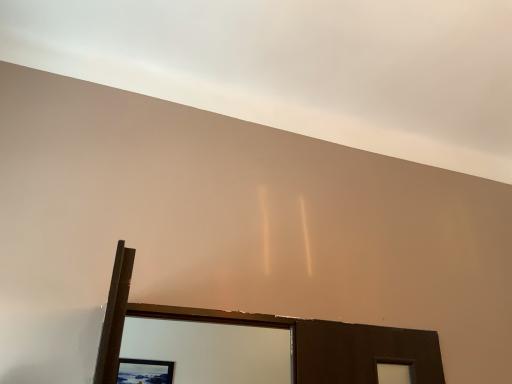
Question: From the image's perspective, is white matte ceiling at upper center located above or below wooden picture frame at lower center?

Choices:
 (A) above
 (B) below

Answer: (A)

Question: Is white matte ceiling at upper center inside or outside of wooden picture frame at lower center?

Choices:
 (A) inside
 (B) outside

Answer: (B)

Question: Is white matte ceiling at upper center taller or shorter than wooden picture frame at lower center?

Choices:
 (A) short
 (B) tall

Answer: (A)

Question: In terms of height, does wooden picture frame at lower center look taller or shorter compared to white matte ceiling at upper center?

Choices:
 (A) tall
 (B) short

Answer: (A)

Question: From the image's perspective, is wooden picture frame at lower center positioned above or below white matte ceiling at upper center?

Choices:
 (A) below
 (B) above

Answer: (A)

Question: Is wooden picture frame at lower center situated inside white matte ceiling at upper center or outside?

Choices:
 (A) inside
 (B) outside

Answer: (B)

Question: Is wooden picture frame at lower center to the left or to the right of white matte ceiling at upper center in the image?

Choices:
 (A) right
 (B) left

Answer: (B)